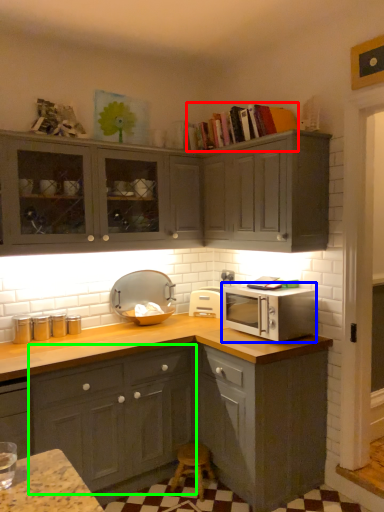
Question: Considering the real-world distances, which object is farthest from book (highlighted by a red box)? microwave oven (highlighted by a blue box) or cabinetry (highlighted by a green box)?

Choices:
 (A) microwave oven
 (B) cabinetry

Answer: (B)